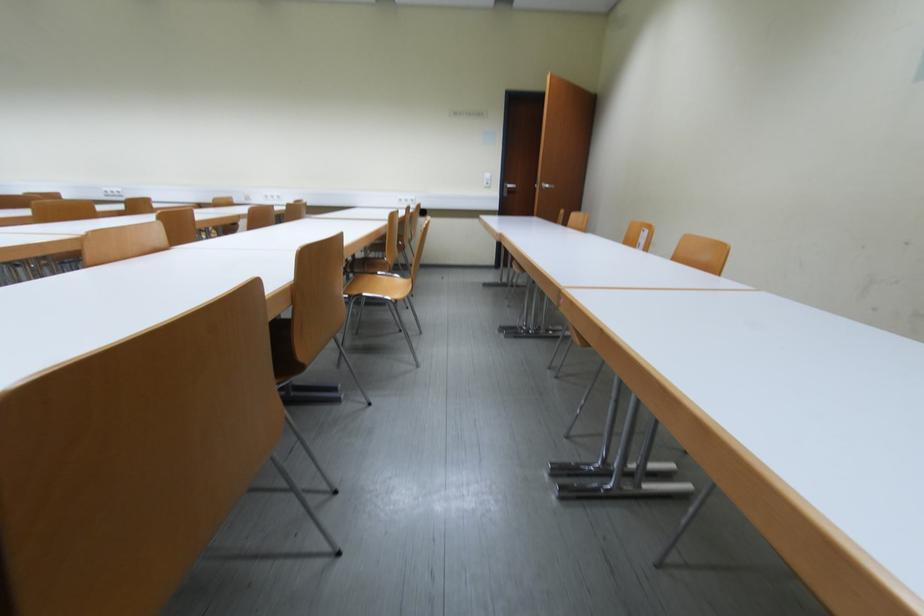
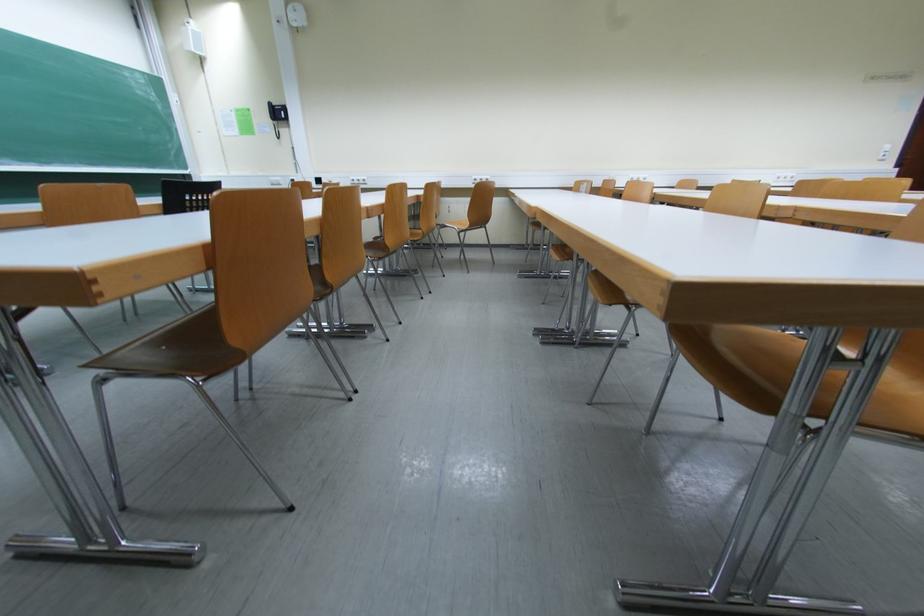
Question: In a continuous first-person perspective shot, in which direction is the camera moving?

Choices:
 (A) Left
 (B) Right
 (C) Forward
 (D) Backward

Answer: (A)